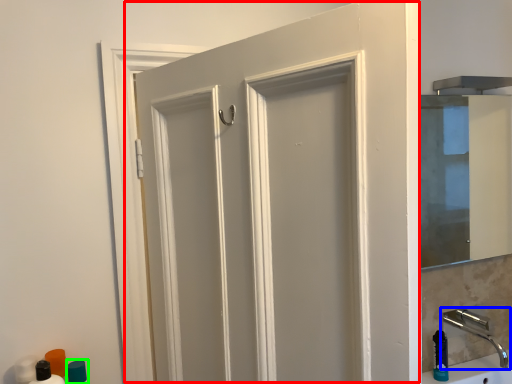
Question: Which object is the farthest from door (highlighted by a red box)? Choose among these: tap (highlighted by a blue box) or toiletry (highlighted by a green box).

Choices:
 (A) tap
 (B) toiletry

Answer: (A)